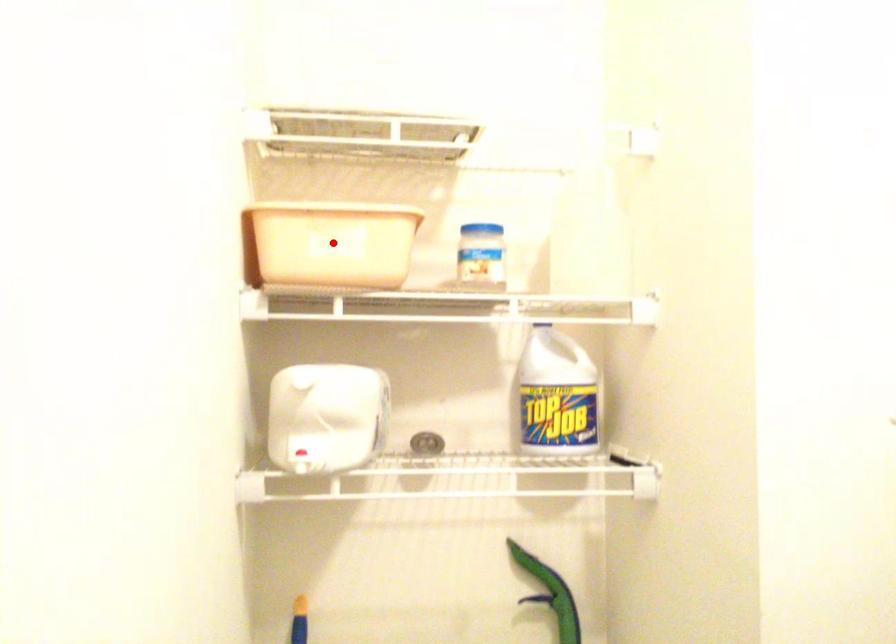
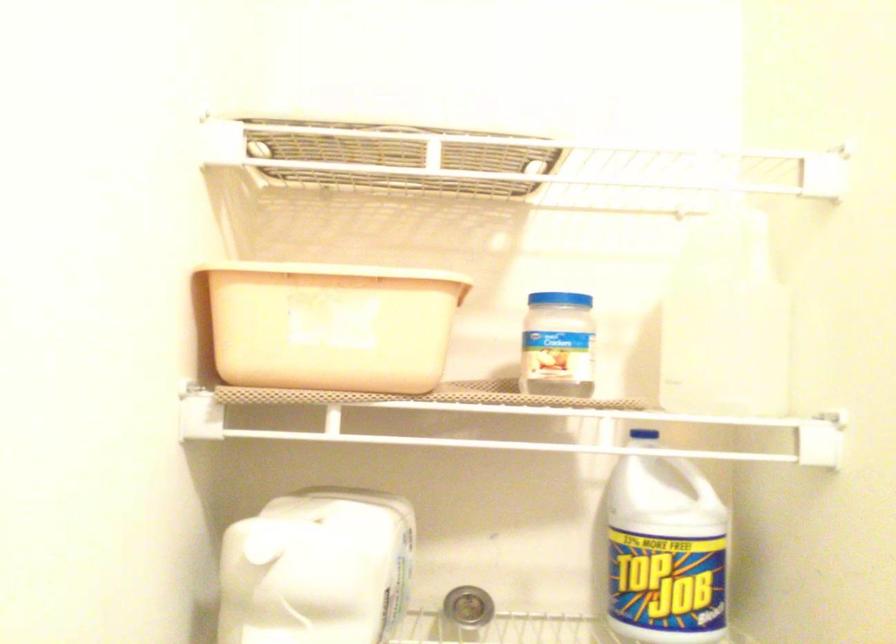
Question: A red point is marked in image1. In image2, is the corresponding 3D point closer to the camera or farther? Reply with the corresponding letter.

Choices:
 (A) The corresponding 3D point is closer.
 (B) The corresponding 3D point is farther.

Answer: (A)